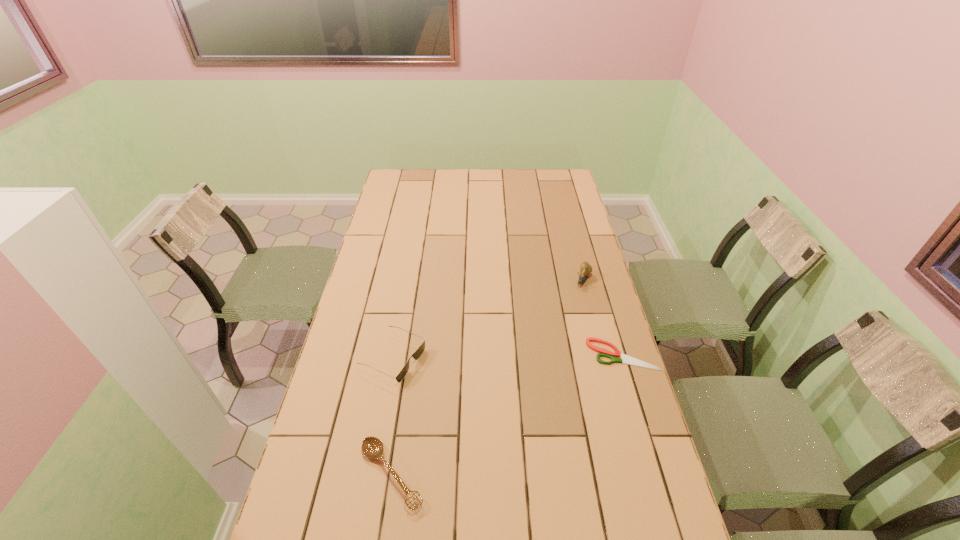
You are a GUI agent. You are given a task and a screenshot of the screen. Output one action in this format:
    pyautogui.click(x=<x>, y=<y>)
    Task: Click on the vacant space located on the front-facing side of the second tallest object
    This screenshot has height=540, width=960.
    Given the screenshot: What is the action you would take?
    pyautogui.click(x=493, y=402)

Identify the location of blank area located 0.090m on the front-facing side of the escargot. The width and height of the screenshot is (960, 540). (575, 305).

Where is `vacant space located 0.400m on the front-facing side of the escargot`? The height and width of the screenshot is (540, 960). vacant space located 0.400m on the front-facing side of the escargot is located at coordinates (545, 370).

At what (x,y) coordinates should I click in order to perform the action: click on vacant area situated 0.310m on the front-facing side of the escargot. Please return your answer as a coordinate pair (x, y). The height and width of the screenshot is (540, 960). Looking at the image, I should click on (555, 349).

In order to click on object present at the near edge in this screenshot , I will do `click(372, 447)`.

At what (x,y) coordinates should I click in order to perform the action: click on ladle that is at the left edge. Please return your answer as a coordinate pair (x, y). The width and height of the screenshot is (960, 540). Looking at the image, I should click on (372, 447).

Identify the location of sunglasses that is at the left edge. (416, 355).

Find the location of `scissors at the right edge`. scissors at the right edge is located at coordinates (625, 359).

Image resolution: width=960 pixels, height=540 pixels. In order to click on escargot located at the right edge in this screenshot , I will do `click(585, 268)`.

You are a GUI agent. You are given a task and a screenshot of the screen. Output one action in this format:
    pyautogui.click(x=<x>, y=<y>)
    Task: Click on the object positioned at the near left corner
    This screenshot has width=960, height=540.
    Given the screenshot: What is the action you would take?
    pyautogui.click(x=372, y=447)